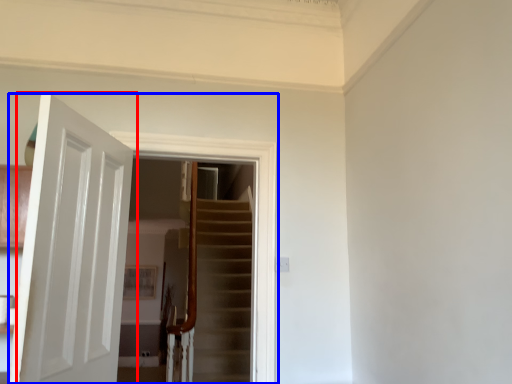
Question: Which object appears closest to the camera in this image, door (highlighted by a red box) or screen door (highlighted by a blue box)?

Choices:
 (A) door
 (B) screen door

Answer: (A)